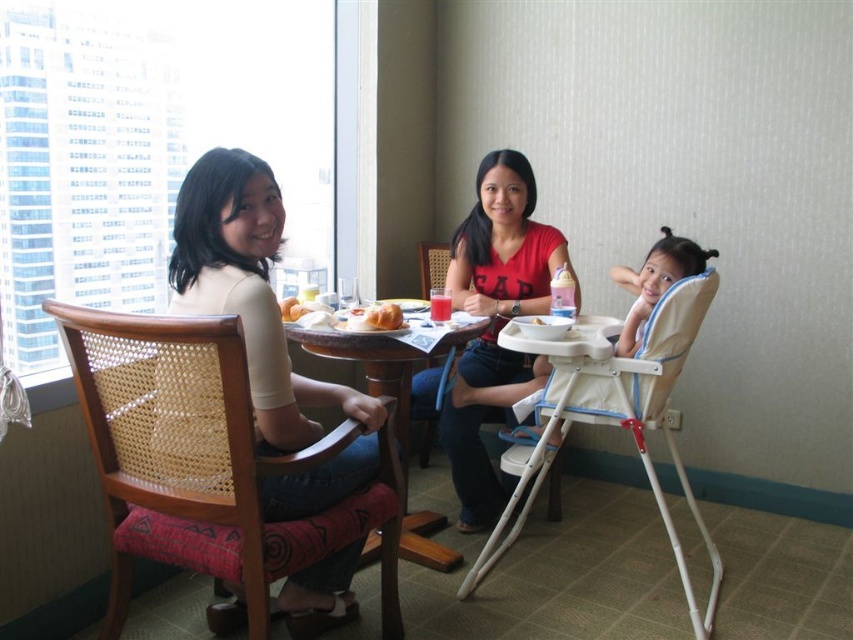
You are a parent holding a toddler who needs to be seated. The toddler is fussy and wants to sit near the window to watch the city view. The white plastic highchair at lower right is currently placed 2.03 meters away from you. Can you place the toddler in the highchair without moving it?

The white plastic highchair at lower right is 2.03 meters away from the viewer. Since the parent is holding the toddler and the distance is manageable, they can likely place the toddler in the highchair without moving it, provided there are no obstacles in the way.